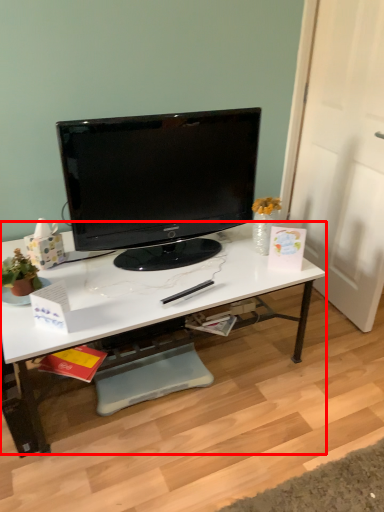
Question: Observing the image, what is the correct spatial positioning of desk (annotated by the red box) in reference to television?

Choices:
 (A) right
 (B) left

Answer: (B)